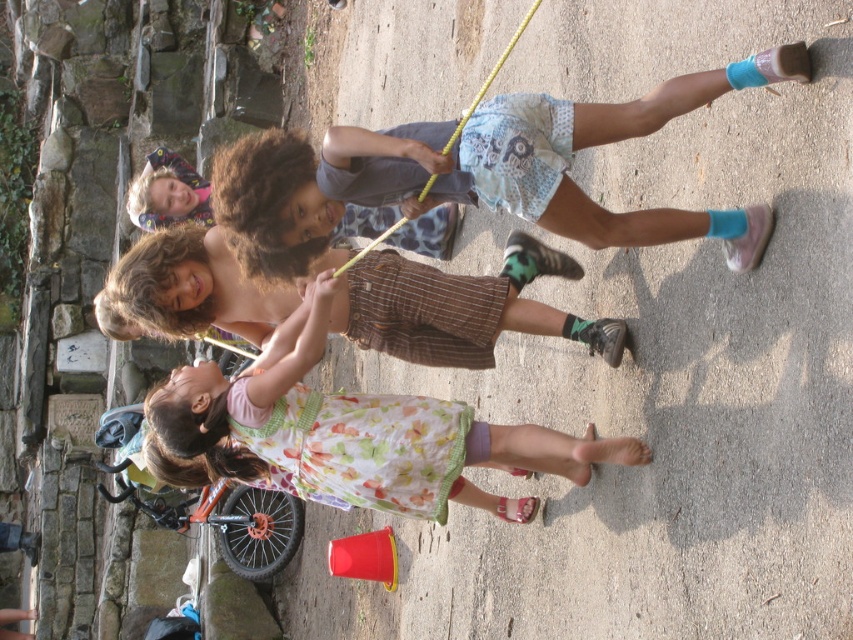
Question: Is blonde hair at upper left wider than yellow rubber rope at center?

Choices:
 (A) yes
 (B) no

Answer: (A)

Question: Does brown plaid shorts at center appear under yellow rubber rope at center?

Choices:
 (A) yes
 (B) no

Answer: (A)

Question: Observing the image, what is the correct spatial positioning of light blue printed shorts at upper right in reference to yellow rubber rope at center?

Choices:
 (A) left
 (B) right

Answer: (A)

Question: Which of the following is the farthest from the observer?

Choices:
 (A) (340, 272)
 (B) (190, 292)
 (C) (405, 468)

Answer: (B)

Question: Which of the following is the farthest from the observer?

Choices:
 (A) (323, 224)
 (B) (426, 186)
 (C) (178, 218)
 (D) (503, 454)

Answer: (C)

Question: Which of the following is the farthest from the observer?

Choices:
 (A) brown plaid shorts at center
 (B) blonde hair at upper left
 (C) floral cotton dress at center
 (D) yellow rubber rope at center

Answer: (B)